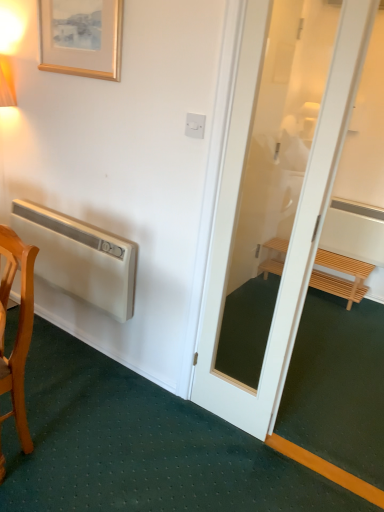
This screenshot has height=512, width=384. What do you see at coordinates (80, 257) in the screenshot? I see `white matte air conditioner at left` at bounding box center [80, 257].

What is the approximate height of white matte air conditioner at left?

The height of white matte air conditioner at left is 17.25 inches.

Identify the location of wooden chair at lower left. The image size is (384, 512). (17, 332).

Is white matte air conditioner at left positioned far away from wooden chair at lower left?

No, white matte air conditioner at left is not far from wooden chair at lower left.

Considering the positions of point (75, 259) and point (21, 351), is point (75, 259) closer or farther from the camera than point (21, 351)?

Clearly, point (75, 259) is more distant from the camera than point (21, 351).

Which of these two, wooden chair at lower left or light brown wooden bench at right, is thinner?

Thinner between the two is wooden chair at lower left.

Is wooden chair at lower left not close to light brown wooden bench at right?

Yes, wooden chair at lower left and light brown wooden bench at right are quite far apart.

From a real-world perspective, does wooden chair at lower left stand above light brown wooden bench at right?

Yes, from a real-world perspective, wooden chair at lower left is over light brown wooden bench at right

Can you tell me how much wooden framed print at upper left and wooden chair at lower left differ in facing direction?

2.53 degrees separate the facing orientations of wooden framed print at upper left and wooden chair at lower left.

In the image, is wooden framed print at upper left positioned in front of or behind wooden chair at lower left?

Visually, wooden framed print at upper left is located behind wooden chair at lower left.

From their relative heights in the image, would you say wooden framed print at upper left is taller or shorter than wooden chair at lower left?

In the image, wooden framed print at upper left appears to be shorter than wooden chair at lower left.

Locate an element on the screen. The image size is (384, 512). chair in front of the wooden framed print at upper left is located at coordinates tap(17, 332).

Is wooden chair at lower left facing away from white matte air conditioner at left?

Absolutely, wooden chair at lower left is directed away from white matte air conditioner at left.

Is wooden chair at lower left to the right of white matte air conditioner at left from the viewer's perspective?

Incorrect, wooden chair at lower left is not on the right side of white matte air conditioner at left.

From a real-world perspective, which is physically above, wooden chair at lower left or white matte air conditioner at left?

white matte air conditioner at left, from a real-world perspective.

From the image's perspective, which object appears higher, wooden chair at lower left or wooden framed print at upper left?

wooden framed print at upper left, from the image's perspective.

In the scene shown: Considering the sizes of objects wooden chair at lower left and wooden framed print at upper left in the image provided, who is thinner, wooden chair at lower left or wooden framed print at upper left?

wooden framed print at upper left is thinner.

From a real-world perspective, between wooden chair at lower left and wooden framed print at upper left, who is vertically lower?

wooden chair at lower left, from a real-world perspective.

Would you say wooden chair at lower left is inside or outside wooden framed print at upper left?

wooden chair at lower left exists outside the volume of wooden framed print at upper left.

In the scene shown: From a real-world perspective, is wooden framed print at upper left under light brown wooden bench at right?

Incorrect, from a real-world perspective, wooden framed print at upper left is higher than light brown wooden bench at right.

Is point (80, 17) positioned before point (266, 276)?

Yes, it is.

Is wooden framed print at upper left taller or shorter than light brown wooden bench at right?

wooden framed print at upper left is taller than light brown wooden bench at right.

From their relative heights in the image, would you say light brown wooden bench at right is taller or shorter than wooden chair at lower left?

light brown wooden bench at right is shorter than wooden chair at lower left.

How distant is light brown wooden bench at right from wooden chair at lower left?

A distance of 7.45 feet exists between light brown wooden bench at right and wooden chair at lower left.

Would you say light brown wooden bench at right is to the left or to the right of wooden chair at lower left in the picture?

Based on their positions, light brown wooden bench at right is located to the right of wooden chair at lower left.

Which is less distant, (337, 260) or (21, 266)?

Positioned in front is point (21, 266).

You are a GUI agent. You are given a task and a screenshot of the screen. Output one action in this format:
    pyautogui.click(x=<x>, y=<y>)
    Task: Click on the chair below the white matte air conditioner at left (from the image's perspective)
    This screenshot has width=384, height=512.
    Given the screenshot: What is the action you would take?
    pyautogui.click(x=17, y=332)

Where is `chair on the left of light brown wooden bench at right`? chair on the left of light brown wooden bench at right is located at coordinates point(17,332).

Looking at the image, which one is located further to wooden chair at lower left, wooden framed print at upper left or light brown wooden bench at right?

light brown wooden bench at right lies further to wooden chair at lower left than the other object.

When comparing their distances from light brown wooden bench at right, does wooden framed print at upper left or white matte air conditioner at left seem closer?

white matte air conditioner at left is closer to light brown wooden bench at right.

Estimate the real-world distances between objects in this image. Which object is closer to light brown wooden bench at right, white matte air conditioner at left or wooden chair at lower left?

white matte air conditioner at left lies closer to light brown wooden bench at right than the other object.

Looking at the image, which one is located further to light brown wooden bench at right, wooden chair at lower left or wooden framed print at upper left?

wooden chair at lower left lies further to light brown wooden bench at right than the other object.

From the image, which object appears to be nearer to light brown wooden bench at right, wooden chair at lower left or white matte air conditioner at left?

Based on the image, white matte air conditioner at left appears to be nearer to light brown wooden bench at right.

From the image, which object appears to be farther from wooden framed print at upper left, light brown wooden bench at right or wooden chair at lower left?

Among the two, light brown wooden bench at right is located further to wooden framed print at upper left.

Estimate the real-world distances between objects in this image. Which object is closer to white matte air conditioner at left, light brown wooden bench at right or wooden chair at lower left?

wooden chair at lower left is closer to white matte air conditioner at left.

Estimate the real-world distances between objects in this image. Which object is further from wooden chair at lower left, light brown wooden bench at right or wooden framed print at upper left?

light brown wooden bench at right.

In order to click on air conditioner between wooden chair at lower left and light brown wooden bench at right from left to right in this screenshot , I will do `click(80, 257)`.

Image resolution: width=384 pixels, height=512 pixels. What are the coordinates of `picture frame between white matte air conditioner at left and light brown wooden bench at right from left to right` in the screenshot? It's located at (82, 41).

Identify the location of air conditioner between wooden framed print at upper left and wooden chair at lower left in the vertical direction. This screenshot has width=384, height=512. [x=80, y=257].

Identify the location of picture frame located between wooden chair at lower left and light brown wooden bench at right in the left-right direction. (82, 41).